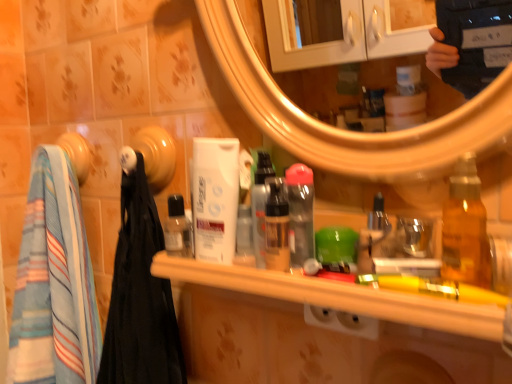
I want to click on unoccupied region to the right of matte plastic mouthwash at center, the 2th mouthwash when ordered from right to left, so click(x=408, y=279).